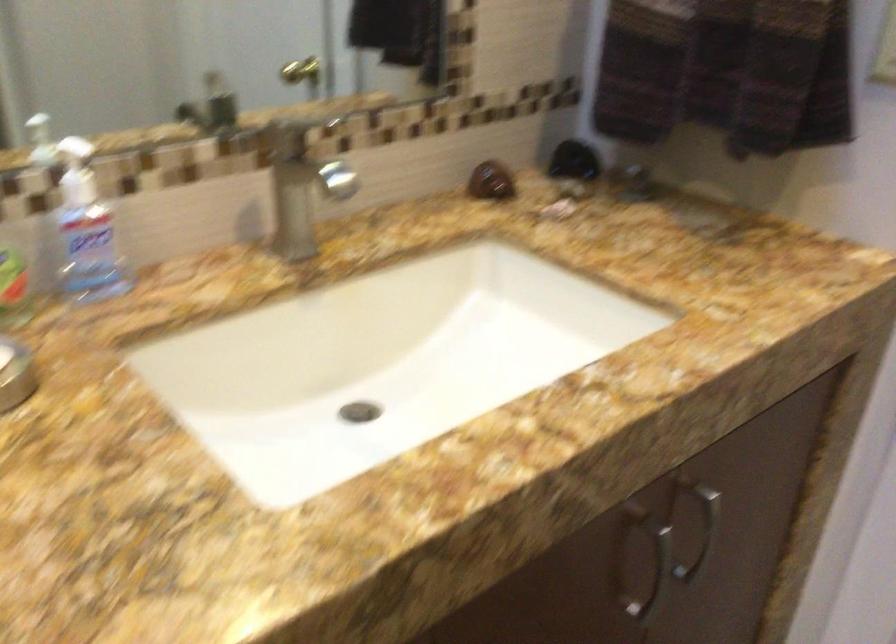
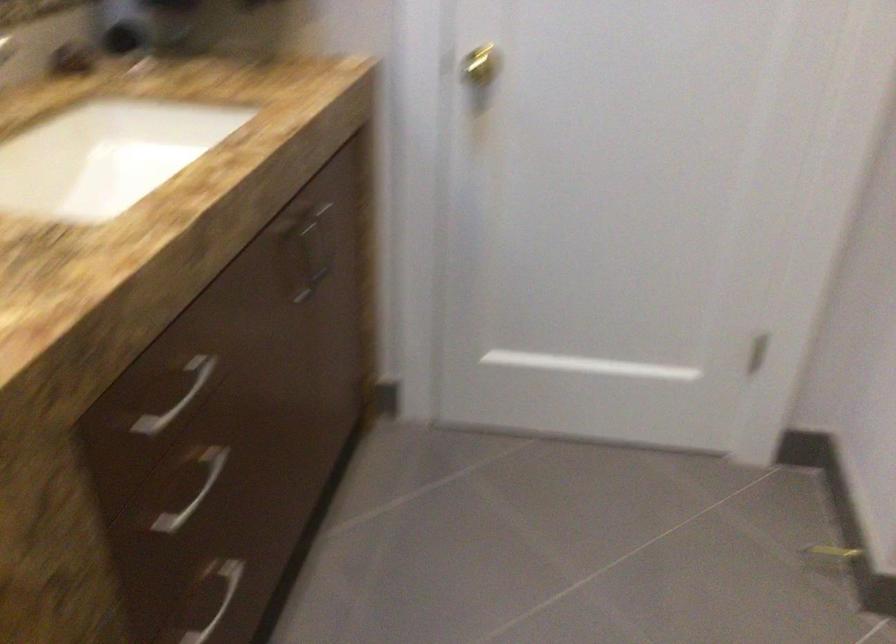
Question: The first image is from the beginning of the video and the second image is from the end. How did the camera likely rotate when shooting the video?

Choices:
 (A) Left
 (B) Right
 (C) Up
 (D) Down

Answer: (B)